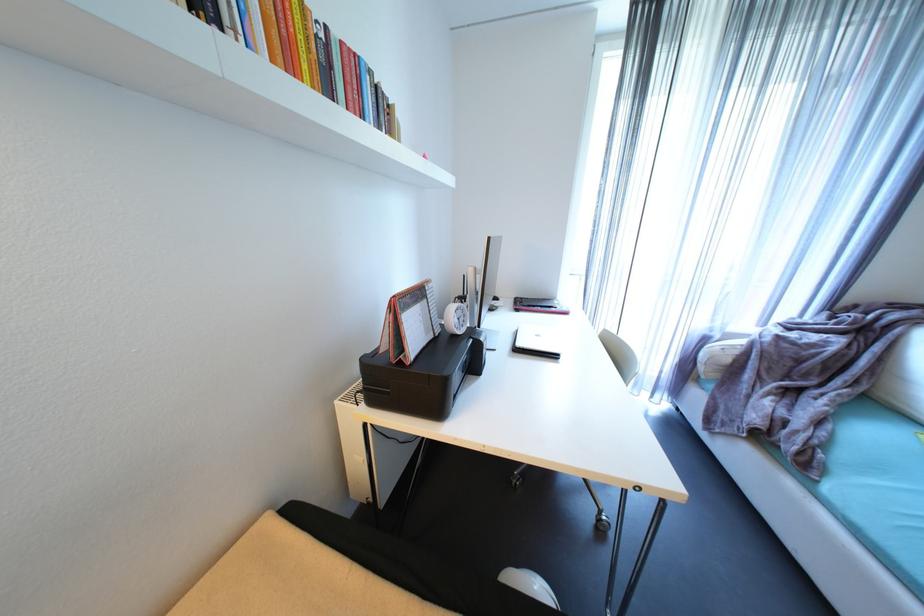
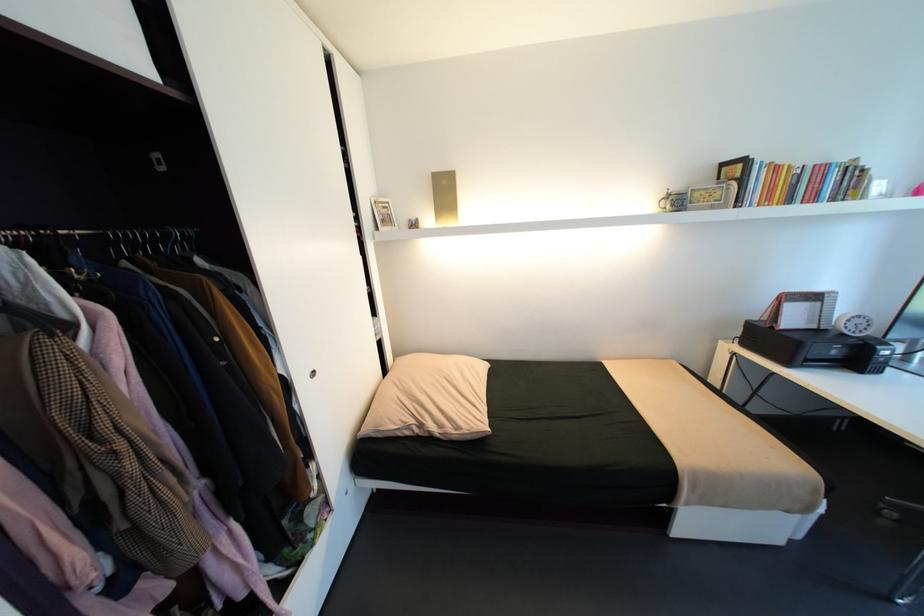
In the second image, find the point that corresponds to pixel 463 336 in the first image.

(850, 334)